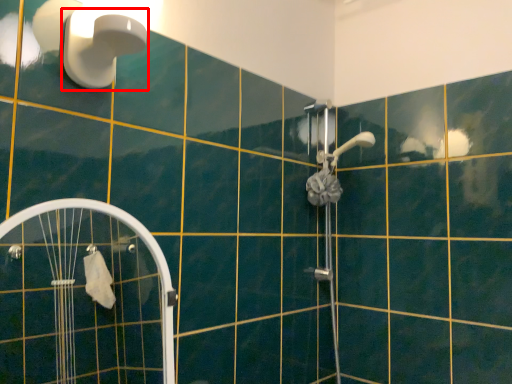
Question: Where is shower (annotated by the red box) located in relation to screen door in the image?

Choices:
 (A) left
 (B) right

Answer: (B)